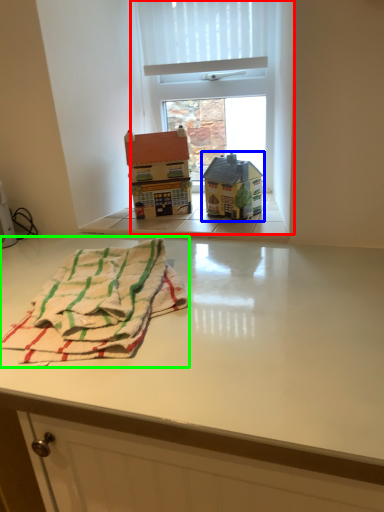
Question: Based on their relative distances, which object is farther from window (highlighted by a red box)? Choose from toy (highlighted by a blue box) and beach towel (highlighted by a green box).

Choices:
 (A) toy
 (B) beach towel

Answer: (B)